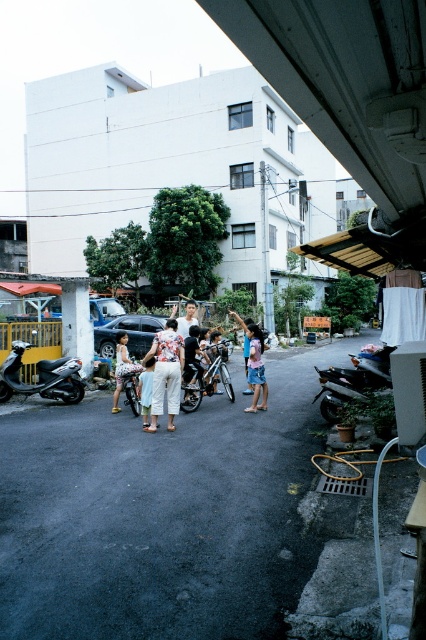
You are a photographer standing in the middle of the street. You want to take a photo of the metallic silver motorcycle at center and the light blue denim shorts at center. Which object will appear larger in your photo?

The metallic silver motorcycle at center will appear larger in the photo because it is closer to the viewer than the light blue denim shorts at center.

You are a photographer trying to capture a group photo of the people in the street scene. You notice the floral fabric dress at center and the light beige pants at center. Which of these two items should you focus on to ensure it stands out more in the photo?

The floral fabric dress at center has a larger size compared to light beige pants at center, so focusing on the floral fabric dress at center will make it stand out more in the photo.